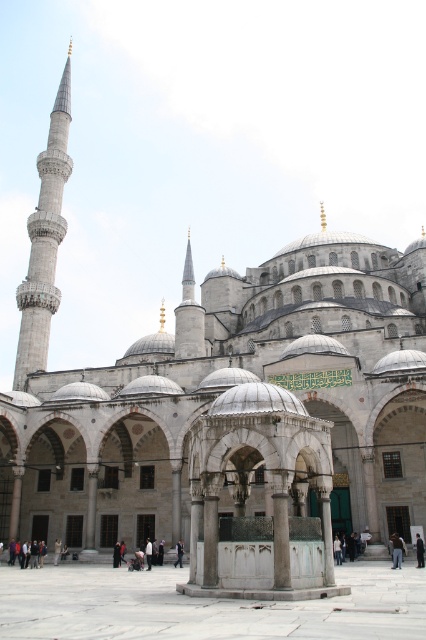
You are standing in front of the Blue Mosque and notice a white marble fountain at center and a white fabric person at center. Which object is closer to you?

The white marble fountain at center is positioned over the white fabric person at center, indicating it is closer to you.

You are a tourist standing at the brown leather jacket at lower right position. You want to take a photo of the gray stone minaret at left. Considering the distance between them, is it possible to capture the entire minaret in your smartphone camera without moving closer? Please explain your reasoning based on the given distance.

The gray stone minaret at left is 73.72 meters away from the brown leather jacket at lower right. Most smartphones have a maximum zoom range effective for distances up to around 50 meters. Since the distance exceeds this limit, capturing the entire minaret without moving closer may not be feasible due to the limited zoom capabilities of smartphones.